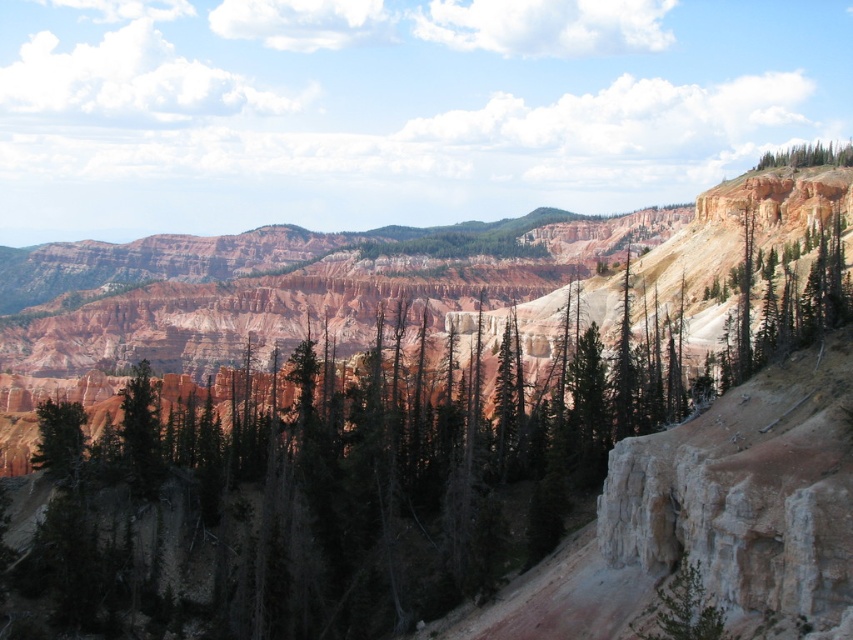
Does green matte tree at center appear over green textured tree at upper right?

No.

Does green matte tree at center lie in front of green textured tree at upper right?

Yes.

Locate an element on the screen. green matte tree at center is located at coordinates (328, 486).